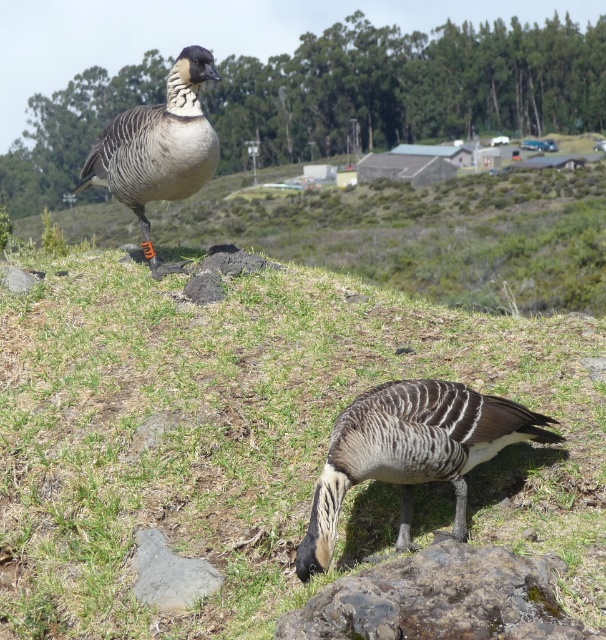
Consider the image. You are standing at the point marked by the coordinates point [255,438] in the image. Looking around, you see two geese. Which direction should you walk to reach the goose that is actively grazing on the grass?

The point [255,438] is on green grass at upper center. The grazing goose is positioned lower down on the slope, closer to the viewer. Therefore, you should walk downward or towards the lower part of the image to reach the grazing goose.